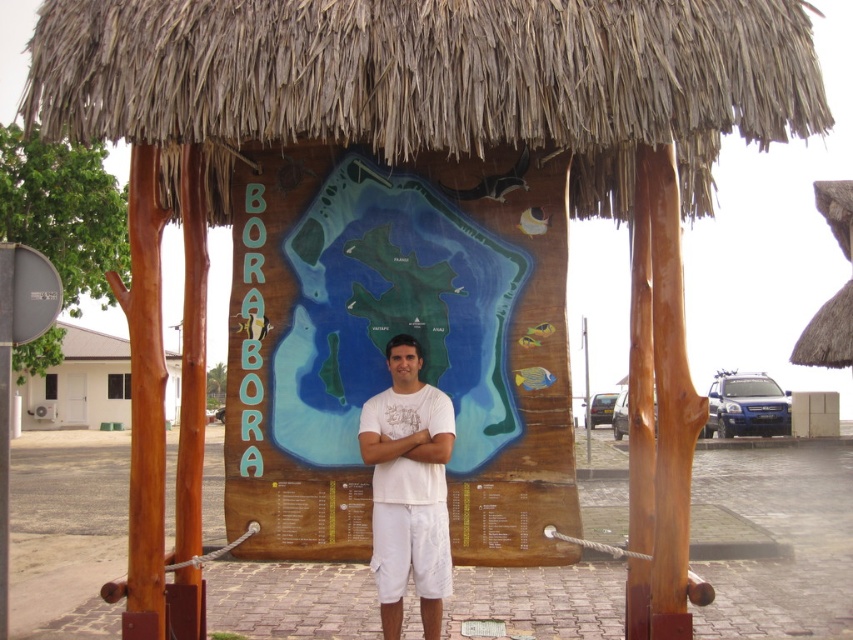
Question: Estimate the real-world distances between objects in this image. Which object is closer to the white cotton t-shirt at center?

Choices:
 (A) brown thatch at upper center
 (B) white wood house at left
 (C) white fabric at center

Answer: (C)

Question: Does white cotton t-shirt at center have a larger size compared to white wood house at left?

Choices:
 (A) no
 (B) yes

Answer: (A)

Question: Among these points, which one is farthest from the camera?

Choices:
 (A) click(367, 435)
 (B) click(750, 13)
 (C) click(380, 518)

Answer: (A)

Question: Does brown thatch at upper center appear over white cotton t-shirt at center?

Choices:
 (A) no
 (B) yes

Answer: (B)

Question: Can you confirm if brown thatch at upper center is positioned to the left of white cotton t-shirt at center?

Choices:
 (A) yes
 (B) no

Answer: (B)

Question: Which point is farther from the camera taking this photo?

Choices:
 (A) (360, 444)
 (B) (172, 422)
 (C) (364, 410)
 (D) (744, 17)

Answer: (B)